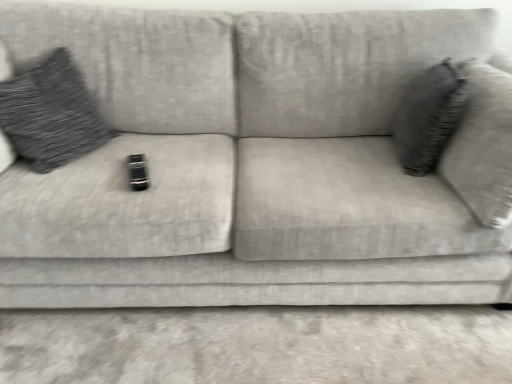
Question: Is there a large distance between textured gray pillow at left, which appears as the 1th throw pillow when viewed from the left, and textured gray pillow at right, acting as the first throw pillow starting from the right?

Choices:
 (A) no
 (B) yes

Answer: (B)

Question: From the image's perspective, does textured gray pillow at left, which appears as the 1th throw pillow when viewed from the left, appear lower than textured gray pillow at right, acting as the first throw pillow starting from the right?

Choices:
 (A) yes
 (B) no

Answer: (B)

Question: From a real-world perspective, is textured gray pillow at left, which appears as the 1th throw pillow when viewed from the left, beneath textured gray pillow at right, placed as the second throw pillow when sorted from left to right?

Choices:
 (A) no
 (B) yes

Answer: (B)

Question: Can you confirm if textured gray pillow at left, which appears as the 1th throw pillow when viewed from the left, is bigger than textured gray pillow at right, acting as the first throw pillow starting from the right?

Choices:
 (A) no
 (B) yes

Answer: (B)

Question: From the image's perspective, is textured gray pillow at left, which appears as the 1th throw pillow when viewed from the left, located above textured gray pillow at right, placed as the second throw pillow when sorted from left to right?

Choices:
 (A) no
 (B) yes

Answer: (B)

Question: Is textured gray pillow at left, which is the second throw pillow in right-to-left order, further to camera compared to textured gray pillow at right, acting as the first throw pillow starting from the right?

Choices:
 (A) no
 (B) yes

Answer: (A)

Question: Does textured gray pillow at right, placed as the second throw pillow when sorted from left to right, have a lesser height compared to textured gray pillow at left, which is the second throw pillow in right-to-left order?

Choices:
 (A) no
 (B) yes

Answer: (B)

Question: Can you confirm if textured gray pillow at right, placed as the second throw pillow when sorted from left to right, is thinner than textured gray pillow at left, which is the second throw pillow in right-to-left order?

Choices:
 (A) no
 (B) yes

Answer: (B)

Question: Does textured gray pillow at right, placed as the second throw pillow when sorted from left to right, appear on the right side of textured gray pillow at left, which appears as the 1th throw pillow when viewed from the left?

Choices:
 (A) no
 (B) yes

Answer: (B)

Question: Can you confirm if textured gray pillow at right, acting as the first throw pillow starting from the right, is wider than textured gray pillow at left, which is the second throw pillow in right-to-left order?

Choices:
 (A) yes
 (B) no

Answer: (B)

Question: Does textured gray pillow at right, placed as the second throw pillow when sorted from left to right, turn towards textured gray pillow at left, which appears as the 1th throw pillow when viewed from the left?

Choices:
 (A) yes
 (B) no

Answer: (A)

Question: Is textured gray pillow at right, placed as the second throw pillow when sorted from left to right, positioned far away from textured gray pillow at left, which appears as the 1th throw pillow when viewed from the left?

Choices:
 (A) yes
 (B) no

Answer: (A)

Question: From a real-world perspective, relative to textured gray pillow at left, which is the second throw pillow in right-to-left order, is textured gray pillow at right, placed as the second throw pillow when sorted from left to right, vertically above or below?

Choices:
 (A) below
 (B) above

Answer: (B)